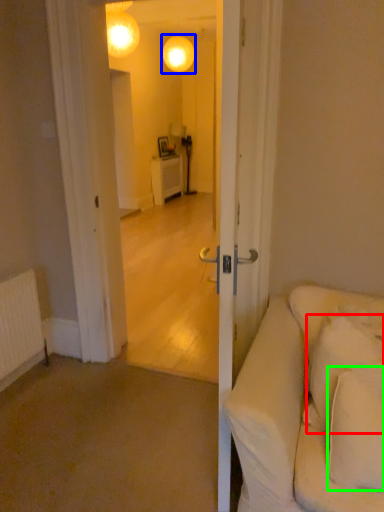
Question: Which object is the closest to the pillow (highlighted by a red box)? Choose among these: lamp (highlighted by a blue box) or pillow (highlighted by a green box).

Choices:
 (A) lamp
 (B) pillow

Answer: (B)